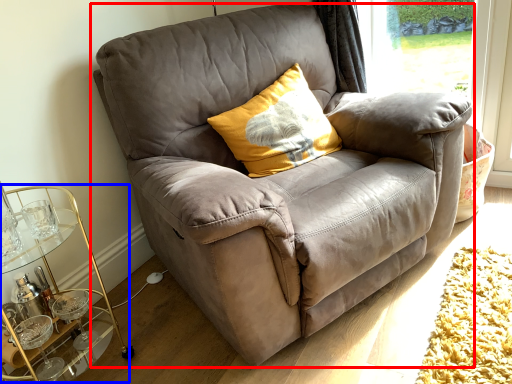
Question: Among these objects, which one is nearest to the camera, chair (highlighted by a red box) or cocktail table (highlighted by a blue box)?

Choices:
 (A) chair
 (B) cocktail table

Answer: (A)